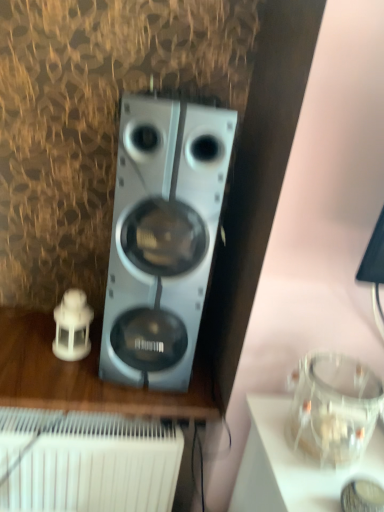
At what (x,y) coordinates should I click in order to perform the action: click on vacant area on top of white plastic speaker at left (from a real-world perspective). Please return your answer as a coordinate pair (x, y). This screenshot has height=512, width=384. Looking at the image, I should click on (61, 354).